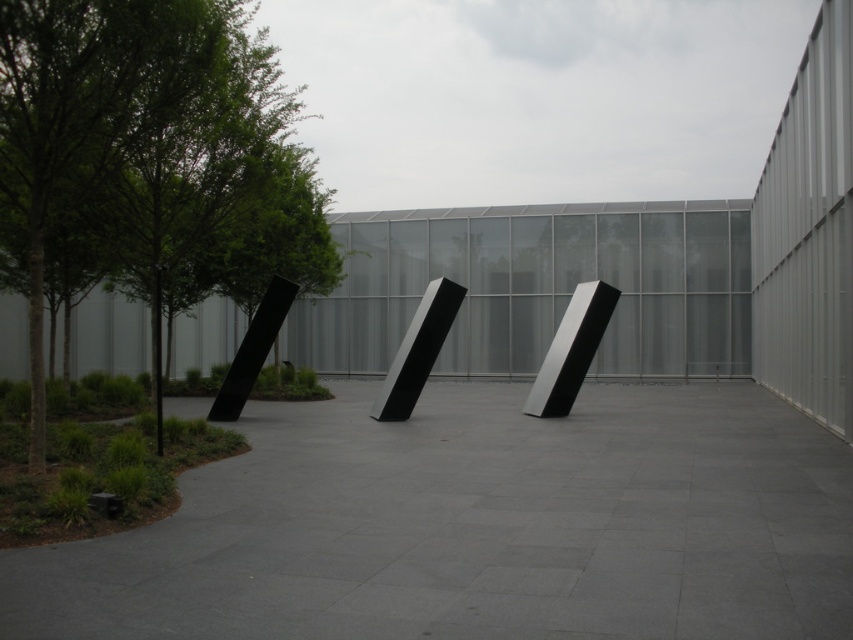
Between gray concrete at center and green leafy tree at left, which one has less height?

With less height is gray concrete at center.

Can you confirm if gray concrete at center is wider than green leafy tree at left?

Incorrect, gray concrete at center's width does not surpass green leafy tree at left's.

This screenshot has height=640, width=853. Find the location of `gray concrete at center`. gray concrete at center is located at coordinates (479, 525).